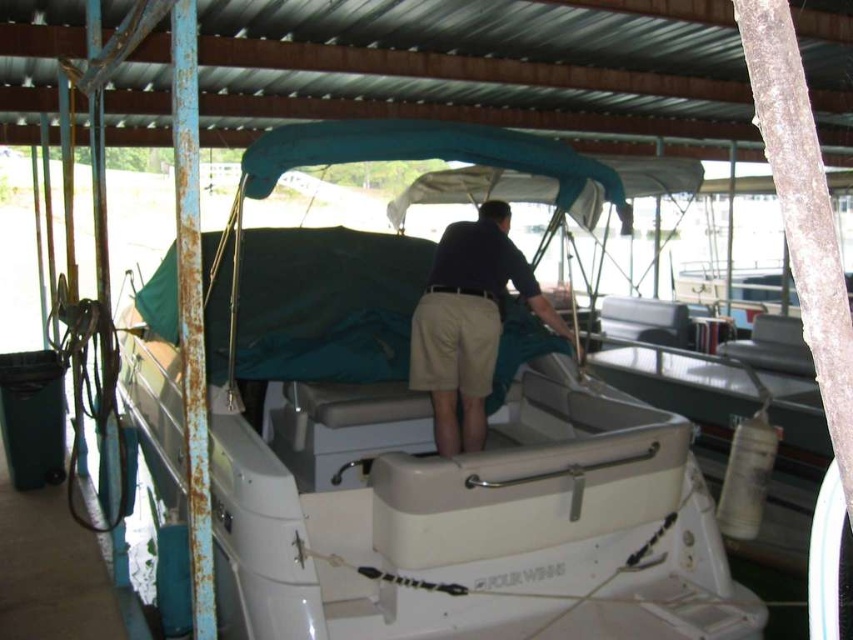
Question: Which point is closer to the camera?

Choices:
 (A) (228, 253)
 (B) (476, 285)

Answer: (B)

Question: Which point is farther to the camera?

Choices:
 (A) white plastic boat at center
 (B) dark blue shirt at center

Answer: (B)

Question: Is white plastic boat at center thinner than dark blue shirt at center?

Choices:
 (A) yes
 (B) no

Answer: (B)

Question: Is white plastic boat at center closer to the viewer compared to dark blue shirt at center?

Choices:
 (A) yes
 (B) no

Answer: (A)

Question: Is white plastic boat at center to the right of dark blue shirt at center from the viewer's perspective?

Choices:
 (A) no
 (B) yes

Answer: (A)